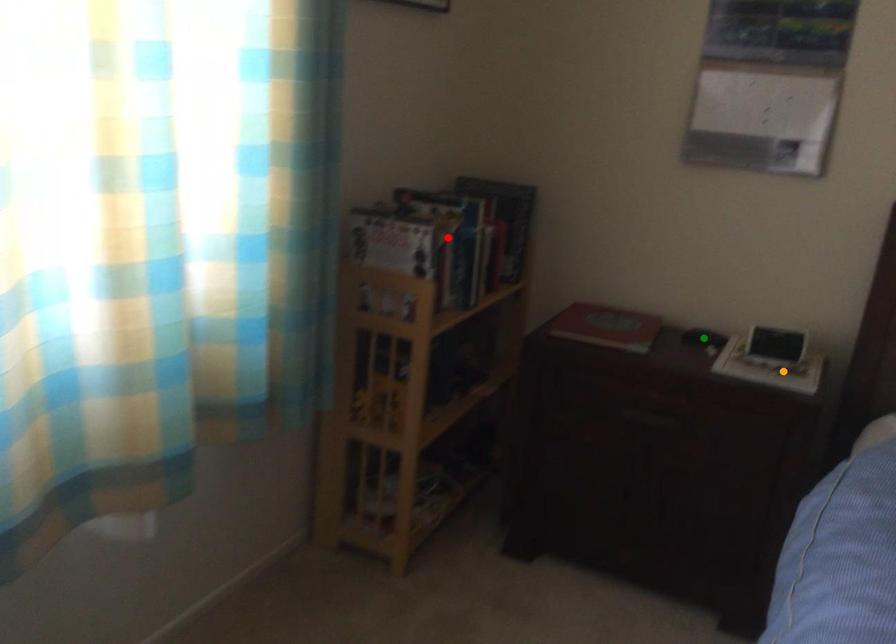
Order these from nearest to farthest:
orange point, green point, red point

1. green point
2. red point
3. orange point